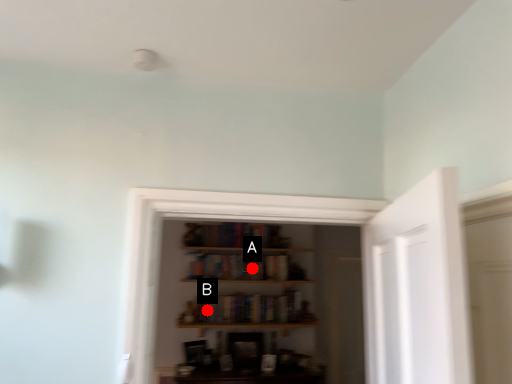
Question: Two points are circled on the image, labeled by A and B beside each circle. Which of the following is the farthest from the observer?

Choices:
 (A) A is further
 (B) B is further

Answer: (A)